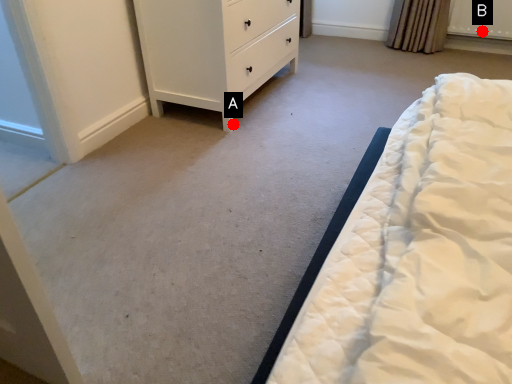
Question: Two points are circled on the image, labeled by A and B beside each circle. Among these points, which one is farthest from the camera?

Choices:
 (A) A is further
 (B) B is further

Answer: (B)